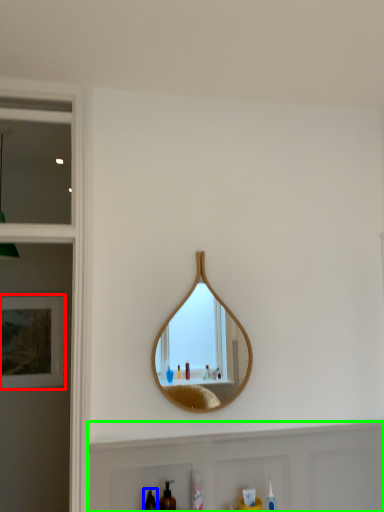
Question: Which object is positioned closest to picture frame (highlighted by a red box)? Select from mouthwash (highlighted by a blue box) and cabinet (highlighted by a green box).

Choices:
 (A) mouthwash
 (B) cabinet

Answer: (B)